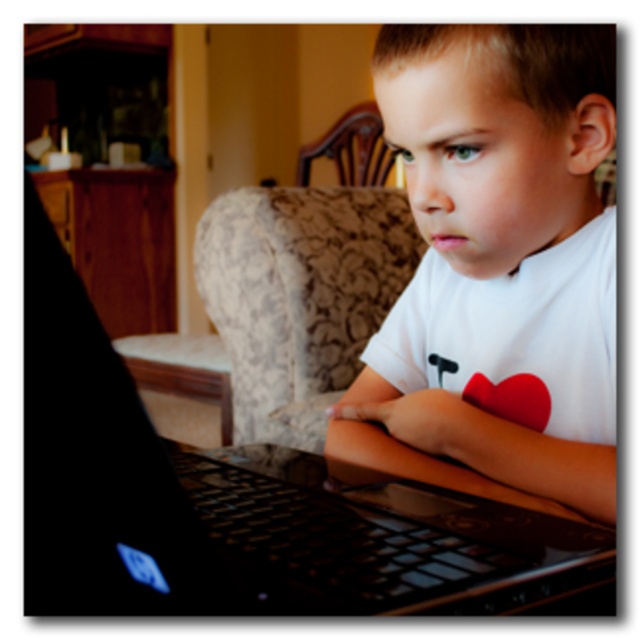
Question: Is black glossy laptop at center smaller than white matte shirt at center?

Choices:
 (A) yes
 (B) no

Answer: (A)

Question: Can you confirm if black glossy laptop at center is smaller than white matte shirt at center?

Choices:
 (A) no
 (B) yes

Answer: (B)

Question: Considering the real-world distances, which object is farthest from the red matte heart at lower center?

Choices:
 (A) wooden chair at upper center
 (B) black glossy laptop at center
 (C) white matte shirt at center

Answer: (A)

Question: Which point appears closest to the camera in this image?

Choices:
 (A) (544, 385)
 (B) (484, 56)

Answer: (B)

Question: Which object is farther from the camera taking this photo?

Choices:
 (A) black glossy laptop at center
 (B) wooden chair at upper center

Answer: (B)

Question: Is black glossy laptop at center positioned in front of white matte shirt at center?

Choices:
 (A) no
 (B) yes

Answer: (B)